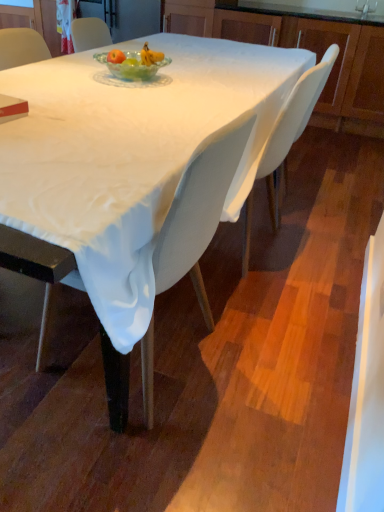
Question: From a real-world perspective, is matte red book at lower left located beneath matte wood cabinet at upper right?

Choices:
 (A) no
 (B) yes

Answer: (A)

Question: Is the position of matte red book at lower left more distant than that of matte wood cabinet at upper right?

Choices:
 (A) yes
 (B) no

Answer: (B)

Question: Is matte red book at lower left looking in the opposite direction of matte wood cabinet at upper right?

Choices:
 (A) yes
 (B) no

Answer: (A)

Question: Does matte red book at lower left touch matte wood cabinet at upper right?

Choices:
 (A) no
 (B) yes

Answer: (A)

Question: From the image's perspective, is matte red book at lower left on top of matte wood cabinet at upper right?

Choices:
 (A) no
 (B) yes

Answer: (A)

Question: Is silver metallic faucet at upper center in front of or behind white fabric chair at center, which is the first chair from front to back, in the image?

Choices:
 (A) front
 (B) behind

Answer: (B)

Question: Is point (370, 11) closer or farther from the camera than point (147, 387)?

Choices:
 (A) farther
 (B) closer

Answer: (A)

Question: Considering the relative positions of silver metallic faucet at upper center and white fabric chair at center, which is the first chair from front to back, in the image provided, is silver metallic faucet at upper center to the left or to the right of white fabric chair at center, which is the first chair from front to back,?

Choices:
 (A) left
 (B) right

Answer: (B)

Question: From a real-world perspective, is silver metallic faucet at upper center above or below white fabric chair at center, which is the 2th chair in back-to-front order?

Choices:
 (A) below
 (B) above

Answer: (B)

Question: From their relative heights in the image, would you say matte red book at lower left is taller or shorter than white fabric chair at center, placed as the second chair when sorted from right to left?

Choices:
 (A) tall
 (B) short

Answer: (B)

Question: From the image's perspective, relative to white fabric chair at center, placed as the second chair when sorted from right to left, is matte red book at lower left above or below?

Choices:
 (A) above
 (B) below

Answer: (A)

Question: Would you say matte red book at lower left is to the left or to the right of white fabric chair at center, placed as the second chair when sorted from right to left, in the picture?

Choices:
 (A) left
 (B) right

Answer: (A)

Question: From a real-world perspective, is matte red book at lower left above or below white fabric chair at center, which is the first chair from front to back?

Choices:
 (A) below
 (B) above

Answer: (B)

Question: From a real-world perspective, is silver metallic faucet at upper center above or below matte wood cabinet at upper right?

Choices:
 (A) above
 (B) below

Answer: (A)

Question: From their relative heights in the image, would you say silver metallic faucet at upper center is taller or shorter than matte wood cabinet at upper right?

Choices:
 (A) tall
 (B) short

Answer: (B)